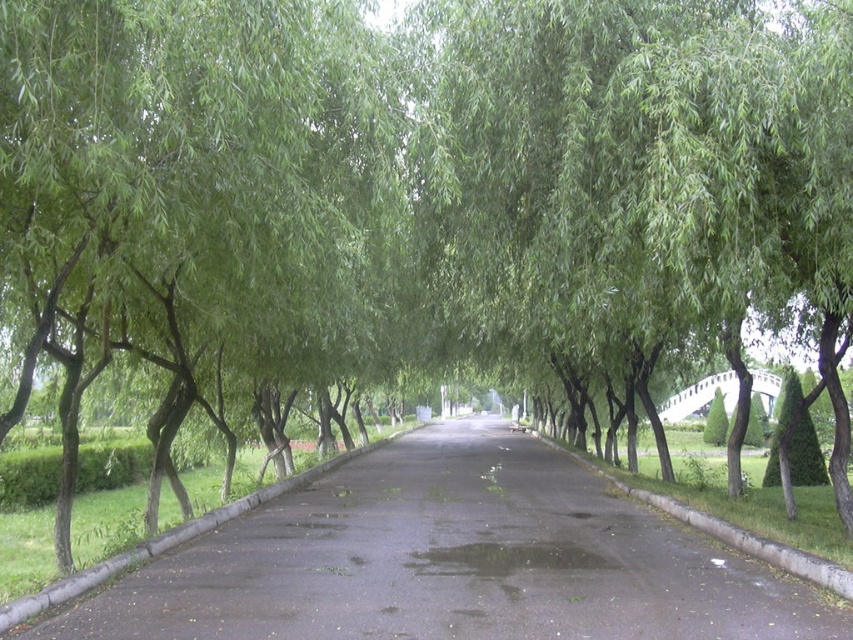
You are a delivery driver who needs to park your 2.5 meter wide truck on the black asphalt road at center. The gray concrete curb at lower right is nearby. Can your truck fit on the road without crossing over the curb? Please explain using the road and curb dimensions.

The black asphalt road at center is wider than the gray concrete curb at lower right. Since the road is wider, it can accommodate a 2.5 meter wide truck without the vehicle crossing over the curb.

You are standing at the entrance of the pathway and want to reach the black asphalt road at center. According to the image, in which direction should you walk relative to the pathway?

The black asphalt road at center is located at point coordinates, so you should walk straight along the pathway towards the center to reach it.